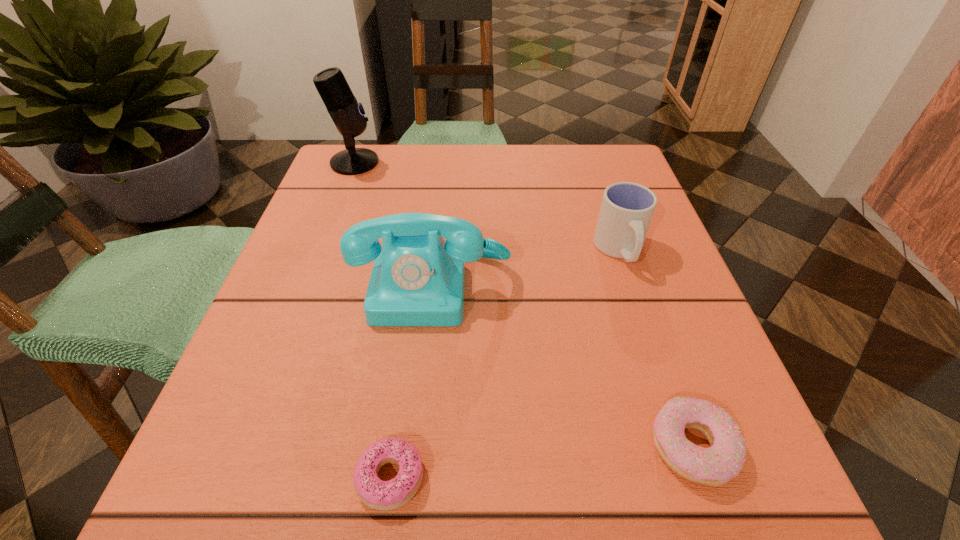
Where is `blank space located with the handle on the side of the third shortest object`? The image size is (960, 540). blank space located with the handle on the side of the third shortest object is located at coordinates (671, 404).

Where is `free space located 0.380m on the left of the fourth tallest object`? This screenshot has width=960, height=540. free space located 0.380m on the left of the fourth tallest object is located at coordinates (351, 447).

This screenshot has width=960, height=540. What are the coordinates of `free location located 0.120m on the left of the shortest object` in the screenshot? It's located at (258, 478).

This screenshot has height=540, width=960. In order to click on object at the far edge in this screenshot , I will do `click(347, 114)`.

The height and width of the screenshot is (540, 960). I want to click on microphone present at the left edge, so click(x=347, y=114).

At what (x,y) coordinates should I click in order to perform the action: click on telephone that is at the left edge. Please return your answer as a coordinate pair (x, y). Looking at the image, I should click on (417, 279).

The image size is (960, 540). What are the coordinates of `cup present at the right edge` in the screenshot? It's located at (627, 208).

The width and height of the screenshot is (960, 540). I want to click on doughnut at the right edge, so click(x=717, y=465).

Image resolution: width=960 pixels, height=540 pixels. In order to click on object that is at the far left corner in this screenshot , I will do `click(347, 114)`.

I want to click on object that is at the near right corner, so click(717, 465).